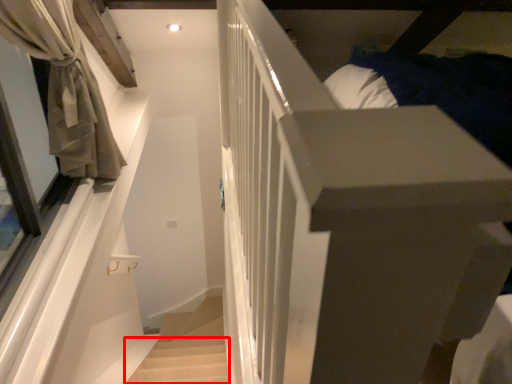
Question: From the image's perspective, where is stairwell (annotated by the red box) located relative to curtain?

Choices:
 (A) below
 (B) above

Answer: (A)